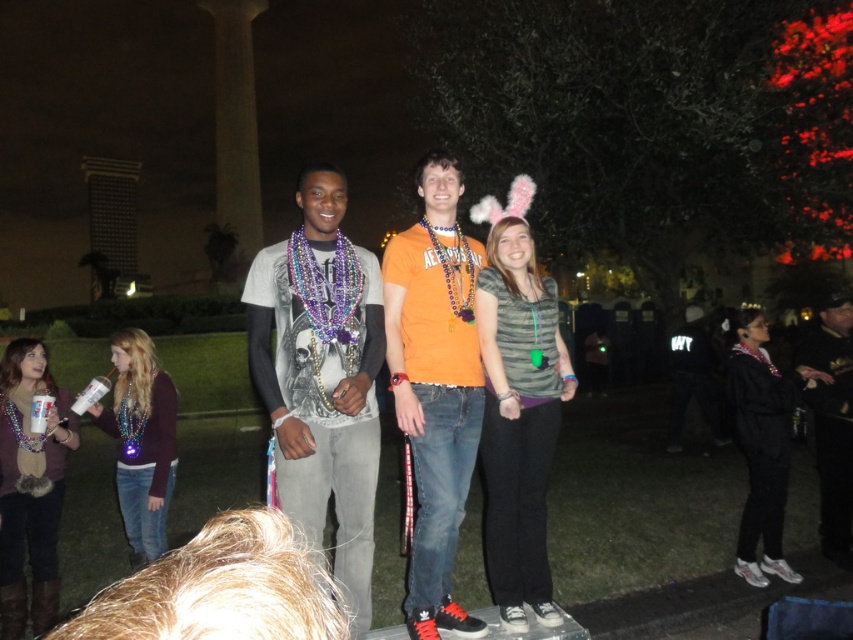
Question: Based on their relative distances, which object is farther from the orange t-shirt at center?

Choices:
 (A) matte gray t-shirt at center
 (B) dark blue uniform at right

Answer: (B)

Question: Which of the following is the closest to the observer?

Choices:
 (A) matte gray t-shirt at center
 (B) orange t-shirt at center

Answer: (A)

Question: Is matte gray t-shirt at center to the left of orange t-shirt at center from the viewer's perspective?

Choices:
 (A) no
 (B) yes

Answer: (B)

Question: Does orange t-shirt at center come in front of dark blue uniform at right?

Choices:
 (A) no
 (B) yes

Answer: (B)

Question: Is orange t-shirt at center to the left of dark blue uniform at right from the viewer's perspective?

Choices:
 (A) yes
 (B) no

Answer: (A)

Question: Considering the real-world distances, which object is farthest from the dark blue uniform at right?

Choices:
 (A) orange t-shirt at center
 (B) matte gray t-shirt at center

Answer: (B)